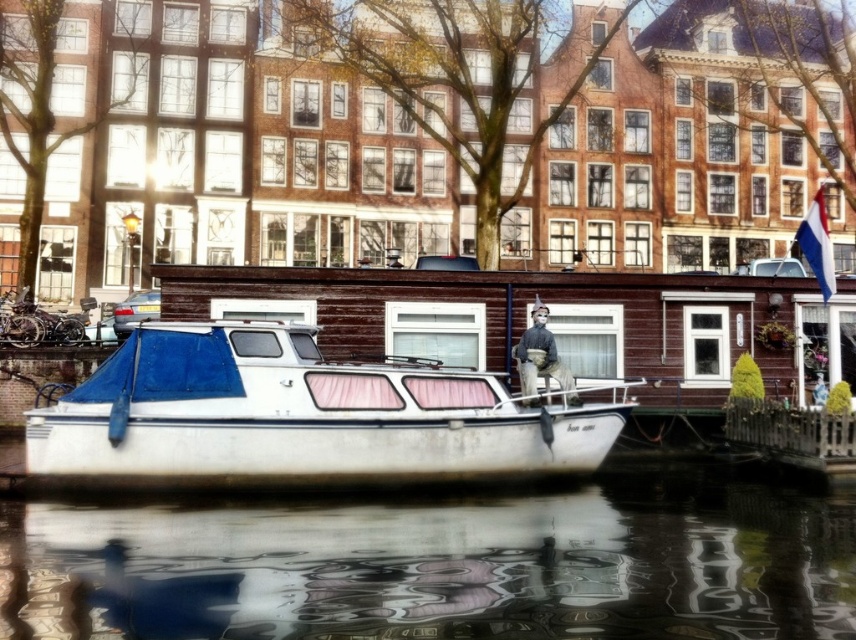
Which is below, glossy reflective water at lower center or white matte boat at center?

glossy reflective water at lower center is lower down.

Is glossy reflective water at lower center bigger than white matte boat at center?

Incorrect, glossy reflective water at lower center is not larger than white matte boat at center.

Identify the location of glossy reflective water at lower center. This screenshot has width=856, height=640. (438, 564).